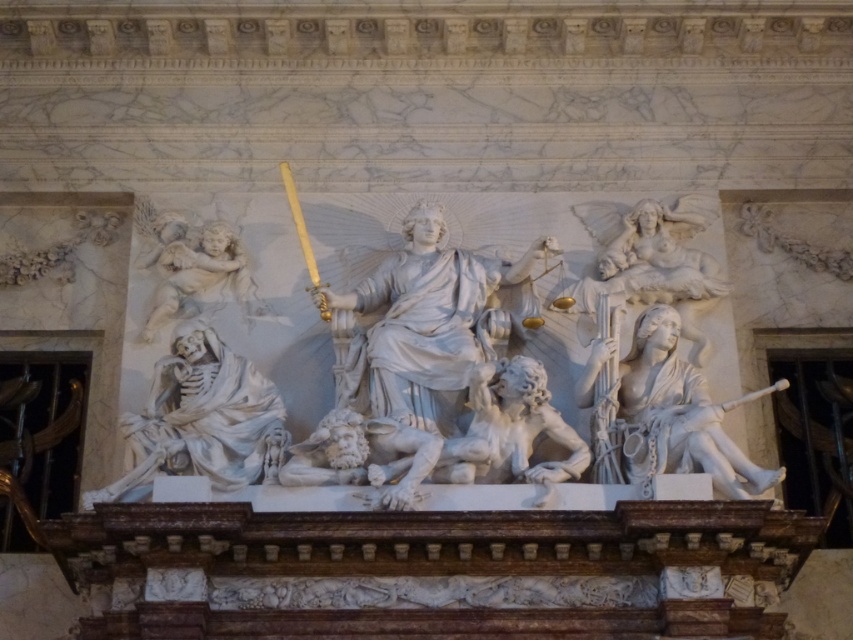
Measure the distance between point (630,413) and camera.

A distance of 230.92 feet exists between point (630,413) and camera.

Which is in front, point (666, 378) or point (595, 280)?

Positioned in front is point (666, 378).

At what (x,y) coordinates should I click in order to perform the action: click on white marble woman at right. Please return your answer as a coordinate pair (x, y). The height and width of the screenshot is (640, 853). Looking at the image, I should click on (677, 413).

Identify the location of white marble woman at right. (677, 413).

Measure the distance between white marble woman at right and white marble cherub at upper left.

24.29 meters

Does point (639, 362) lie behind point (171, 253)?

No, it is in front of (171, 253).

Identify the location of white marble woman at right. (677, 413).

Who is higher up, white marble angel at upper right or white marble cherub at upper left?

white marble angel at upper right is above.

Who is taller, white marble angel at upper right or white marble cherub at upper left?

Standing taller between the two is white marble angel at upper right.

The width and height of the screenshot is (853, 640). What do you see at coordinates (648, 252) in the screenshot?
I see `white marble angel at upper right` at bounding box center [648, 252].

Image resolution: width=853 pixels, height=640 pixels. I want to click on white marble angel at upper right, so click(648, 252).